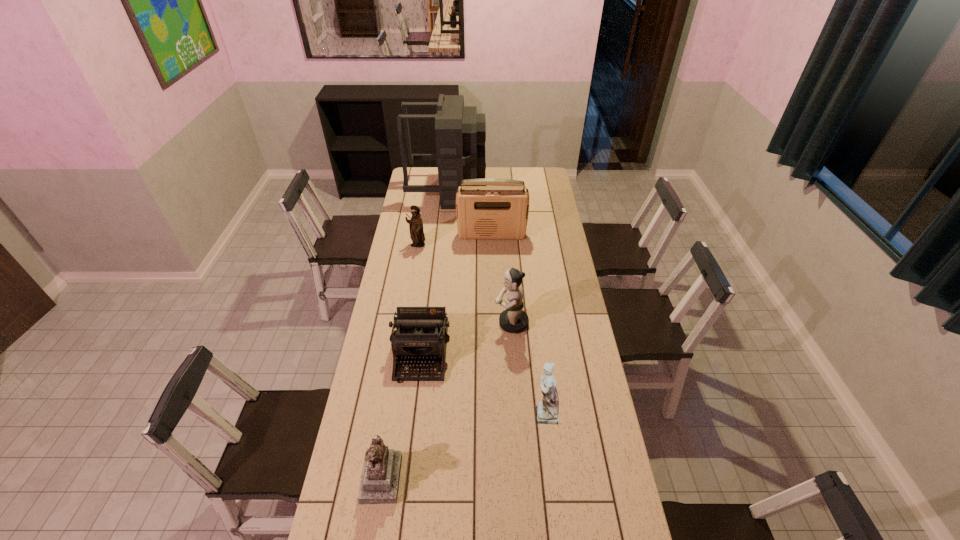
Where is `blank space located on the front-facing side of the second farthest figurine`? blank space located on the front-facing side of the second farthest figurine is located at coordinates (460, 323).

Locate an element on the screen. This screenshot has width=960, height=540. free space located 0.400m on the front-facing side of the second farthest figurine is located at coordinates (402, 323).

Identify the location of free region located on the front-facing side of the second farthest figurine. This screenshot has height=540, width=960. (475, 323).

This screenshot has width=960, height=540. I want to click on vacant region located 0.200m on the front-facing side of the third farthest figurine, so click(472, 412).

This screenshot has width=960, height=540. In order to click on free space located 0.180m on the front-facing side of the third farthest figurine in this screenshot , I will do `click(478, 412)`.

At what (x,y) coordinates should I click in order to perform the action: click on free space located on the front-facing side of the third farthest figurine. Please return your answer as a coordinate pair (x, y). Image resolution: width=960 pixels, height=540 pixels. Looking at the image, I should click on (478, 412).

This screenshot has height=540, width=960. I want to click on free spot located 0.260m on the front-facing side of the farthest figurine, so click(411, 287).

This screenshot has width=960, height=540. I want to click on vacant area situated on the front-facing side of the nearest object, so click(481, 477).

Find the location of a particular element. This screenshot has height=540, width=960. vacant space located on the keyboard of the typewriter is located at coordinates (408, 470).

Locate an element on the screen. Image resolution: width=960 pixels, height=540 pixels. object that is at the far edge is located at coordinates (460, 132).